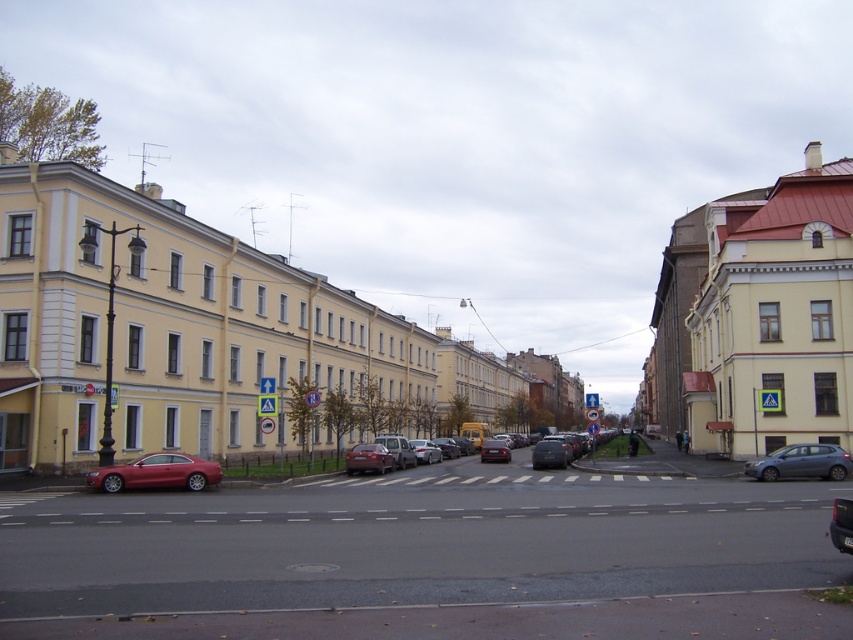
Question: Which point is farther from the camera taking this photo?

Choices:
 (A) (480, 460)
 (B) (817, 474)
 (C) (502, 449)

Answer: (A)

Question: Does matte red car at center have a lesser width compared to satin silver sedan at center?

Choices:
 (A) no
 (B) yes

Answer: (A)

Question: Does shiny red car at lower left appear under satin silver sedan at lower right?

Choices:
 (A) no
 (B) yes

Answer: (A)

Question: Which point is closer to the camera?

Choices:
 (A) matte black car at center
 (B) satin silver sedan at center
 (C) shiny red sedan at center

Answer: (C)

Question: Does shiny red car at lower left appear over satin silver sedan at lower right?

Choices:
 (A) yes
 (B) no

Answer: (A)

Question: Which of the following is the closest to the observer?

Choices:
 (A) matte black car at center
 (B) metallic silver sedan at center
 (C) matte red car at center

Answer: (C)